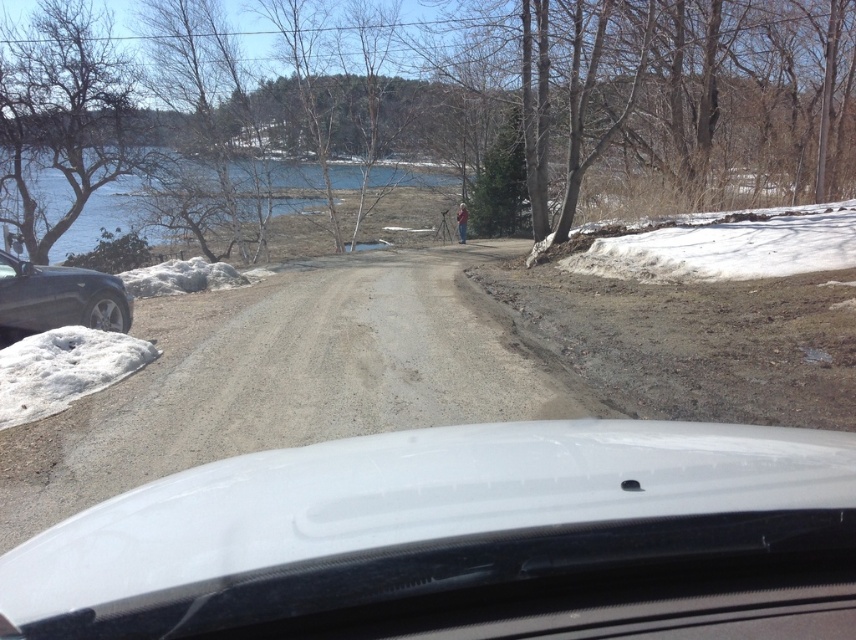
You are driving a car and want to make a U turn on the gray gravel road at center. However, there is a shiny black sedan at left parked nearby. Based on their positions, can you safely complete the U turn without moving the parked car?

The gray gravel road at center is to the right of the shiny black sedan at left, so there is space between them which allows you to safely make the U turn without disturbing the parked car.

You are a passenger in the car and want to take a photo of the white glossy windshield at center through the camera. Since the windshield is 2.09 meters away from the camera, will you need to adjust the focus to capture a clear image?

The white glossy windshield at center and camera are 2.09 meters apart from each other. To capture a clear image, you may need to adjust the focus since the distance might be beyond the camera lens default focus range.

You are driving a car with a 10 feet long trailer attached. You need to navigate through the road in front of you. Can you safely pass through the area near point (797,444) without the trailer hitting anything?

The distance between point (797,444) and the viewer is 11.10 feet. Since the trailer is 10 feet long, there is 1.10 feet of clearance. This should provide enough space for the trailer to pass safely as long as there are no obstacles in the path.